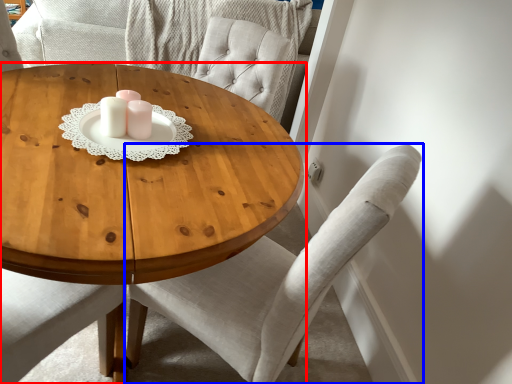
Question: Which object appears closest to the camera in this image, coffee table (highlighted by a red box) or chair (highlighted by a blue box)?

Choices:
 (A) coffee table
 (B) chair

Answer: (A)